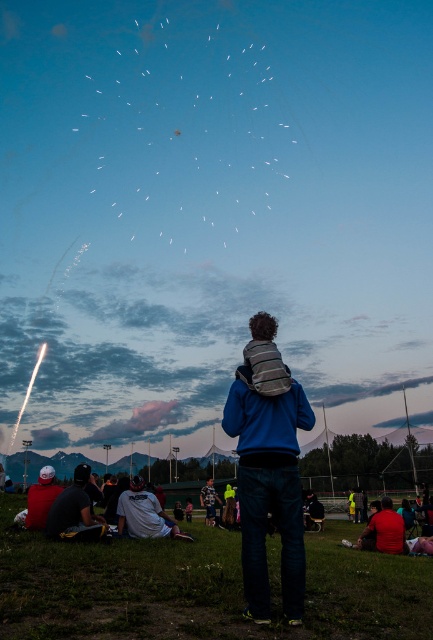
You are a photographer trying to capture the fireworks display. You notice the white stringy kite at upper center and the blue jersey at center in your frame. Which object should you focus on to ensure it takes up more space in the photo?

The white stringy kite at upper center should be focused on because it is bigger than the blue jersey at center, making it more prominent in the photo.

You are a photographer trying to capture the fireworks display. You notice a blue fleece jacket at center located at point (270, 490). If you want to include both the fireworks and the jacket in your shot, where should you position yourself relative to the jacket?

To capture both the fireworks and the blue fleece jacket at center at point (270, 490), position yourself behind the jacket so that the jacket is in the foreground and the fireworks in the sky are in the background of your frame.

You are a photographer trying to capture the fireworks display. You notice two people in the scene, the blue fleece jacket at center and the dark blue shirt at lower left. Which one is positioned to the right of the other?

The blue fleece jacket at center is positioned on the right side of dark blue shirt at lower left.